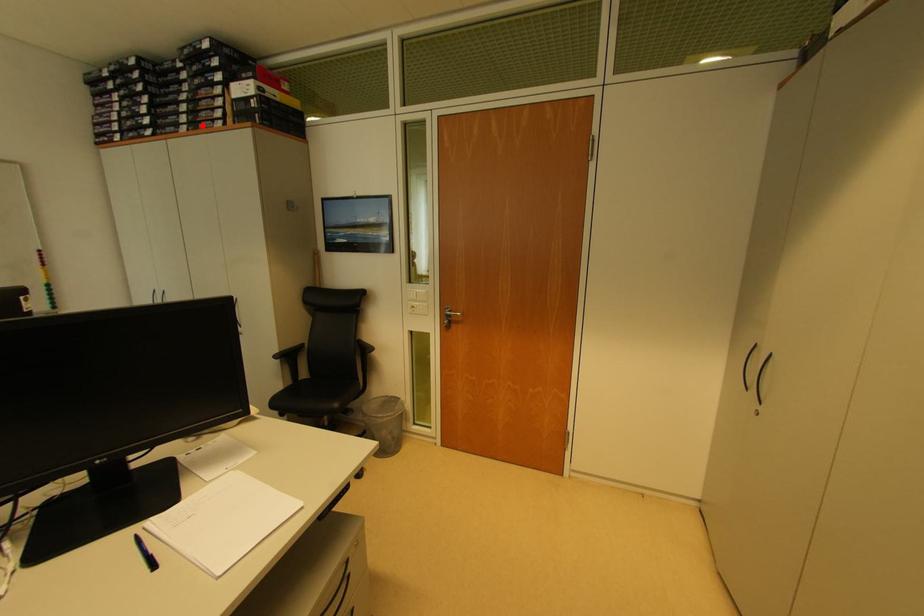
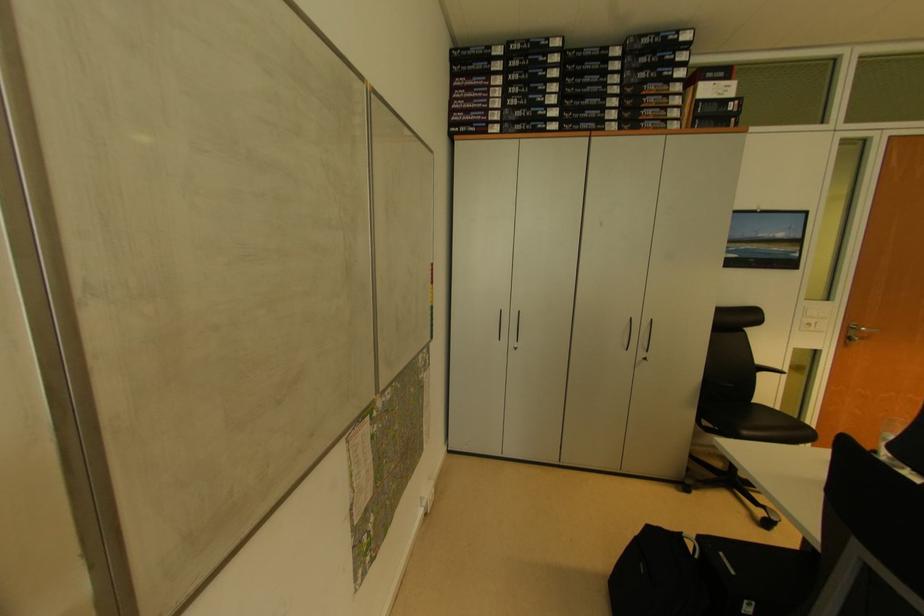
Where in the second image is the point corresponding to the highlighted location from the first image?

(646, 124)